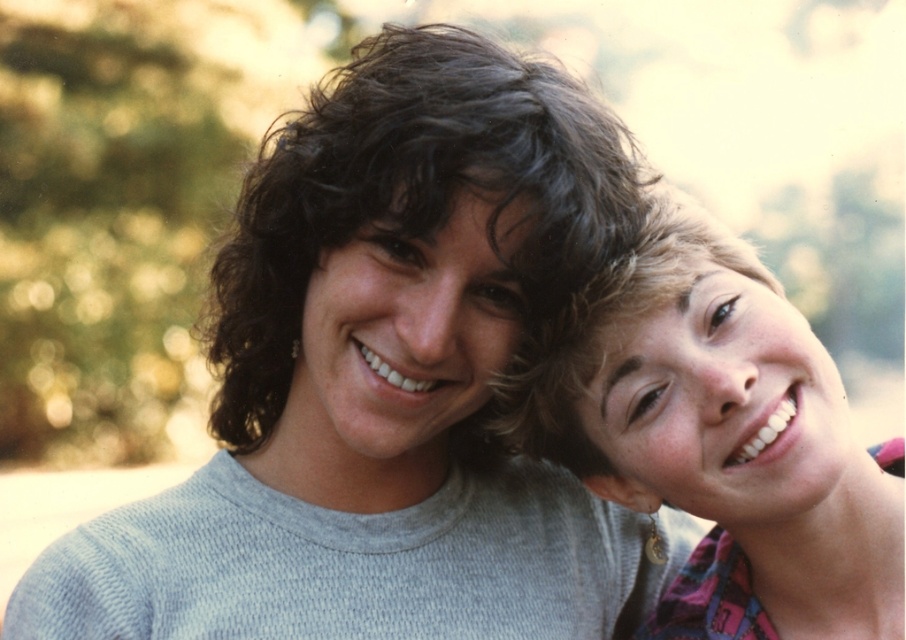
You are a photographer standing 5 feet away from the camera. You want to take a closeup shot of the dark curly hair at center. Can you move closer to get a better shot without exceeding the minimum safe distance of 3 feet from the subject?

The dark curly hair at center is 4.06 feet away from camera. Since you are already 5 feet away, you can move 0.94 feet closer to reach 4.06 minus 0.94 equals 3.12 feet, which is just above the minimum safe distance of 3 feet. Therefore, you can move closer to get a better shot without violating the safety distance.

You are standing in a park and see two points marked in the image. Which point, point (523,227) or point (593,300), is closer to you?

Point (523,227) is closer to the viewer than point (593,300).